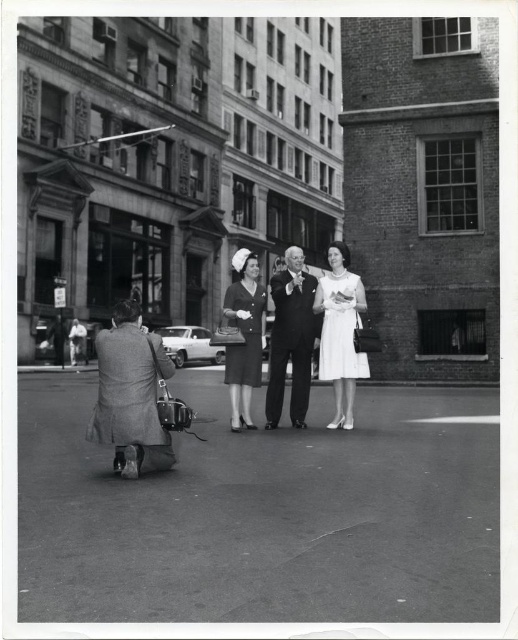
Does matte black coat at lower left have a greater height compared to white satin dress at center?

Incorrect, matte black coat at lower left's height is not larger of white satin dress at center's.

Who is positioned more to the right, matte black coat at lower left or white satin dress at center?

Answer: Positioned to the right is white satin dress at center.

Which is behind, point (154, 337) or point (342, 339)?

Point (342, 339)

Find the location of `matte black coat at lower left`. matte black coat at lower left is located at coordinates (131, 394).

Is point (102, 422) farther from viewer compared to point (243, 372)?

No, (102, 422) is in front of (243, 372).

Does matte black coat at lower left have a greater width compared to matte black dress at center?

Correct, the width of matte black coat at lower left exceeds that of matte black dress at center.

Between point (134, 346) and point (233, 417), which one is positioned in front?

Point (134, 346) is more forward.

Where is `matte black coat at lower left`? The image size is (518, 640). matte black coat at lower left is located at coordinates (131, 394).

From the picture: Which is more to the right, white satin dress at center or matte black dress at center?

Positioned to the right is white satin dress at center.

Where is `white satin dress at center`? The image size is (518, 640). white satin dress at center is located at coordinates (340, 332).

Where is `white satin dress at center`? The image size is (518, 640). white satin dress at center is located at coordinates click(x=340, y=332).

The image size is (518, 640). Identify the location of white satin dress at center. (340, 332).